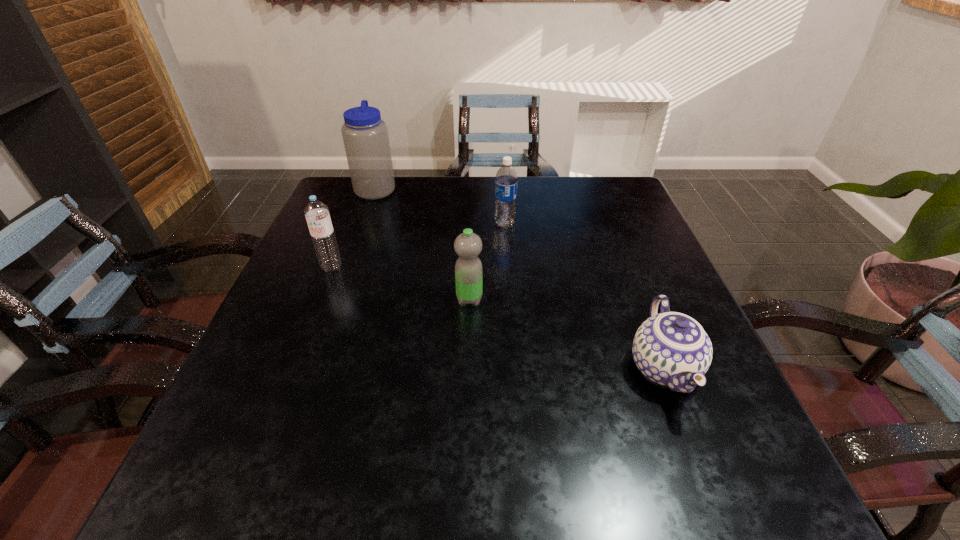
I want to click on free space at the near left corner of the desktop, so click(250, 458).

The image size is (960, 540). In order to click on blank space at the far right corner in this screenshot , I will do `click(621, 186)`.

At what (x,y) coordinates should I click in order to perform the action: click on vacant point located between the third farthest object and the fourth object from left to right. Please return your answer as a coordinate pair (x, y). This screenshot has width=960, height=540. Looking at the image, I should click on 418,245.

The height and width of the screenshot is (540, 960). I want to click on blank region between the tallest object and the nearest water bottle, so click(422, 244).

Locate an element on the screen. The height and width of the screenshot is (540, 960). vacant area between the third farthest object and the nearest water bottle is located at coordinates (400, 283).

The width and height of the screenshot is (960, 540). I want to click on vacant space in between the third farthest object and the chinaware, so click(497, 317).

Where is `free space between the nearest object and the second water bottle from right to left`? This screenshot has width=960, height=540. free space between the nearest object and the second water bottle from right to left is located at coordinates (566, 334).

In order to click on vacant space that's between the fourth farthest object and the second farthest object in this screenshot , I will do `click(487, 262)`.

The width and height of the screenshot is (960, 540). I want to click on blank region between the tallest object and the third object from right to left, so (422, 244).

The height and width of the screenshot is (540, 960). Find the location of `free area in between the second nearest object and the rightmost water bottle`. free area in between the second nearest object and the rightmost water bottle is located at coordinates (487, 262).